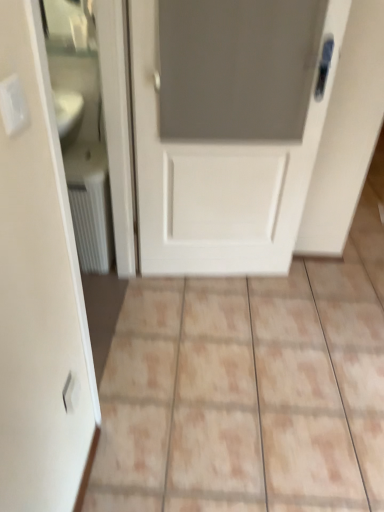
Identify the location of vacant area located to the right-hand side of white matte door at center. The width and height of the screenshot is (384, 512). (316, 297).